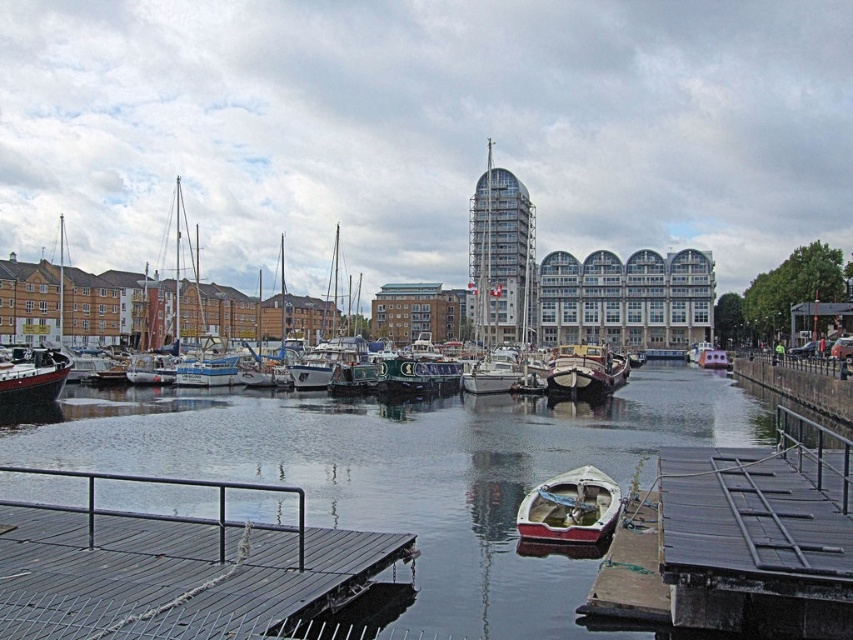
Question: Which object appears farthest from the camera in this image?

Choices:
 (A) wooden polished boat at center
 (B) matte black boat at left

Answer: (A)

Question: Among these objects, which one is farthest from the camera?

Choices:
 (A) smooth dark water at center
 (B) matte black boat at left

Answer: (B)

Question: Which of the following is the farthest from the observer?

Choices:
 (A) (71, 520)
 (B) (578, 348)
 (C) (178, 420)

Answer: (B)

Question: Is dark gray wooden dock at lower left further to camera compared to wooden dock at left?

Choices:
 (A) no
 (B) yes

Answer: (A)

Question: Is dark gray wooden dock at lower left to the right of wooden dock at left from the viewer's perspective?

Choices:
 (A) yes
 (B) no

Answer: (A)

Question: Does dark gray wooden dock at lower left have a greater width compared to matte black boat at left?

Choices:
 (A) yes
 (B) no

Answer: (A)